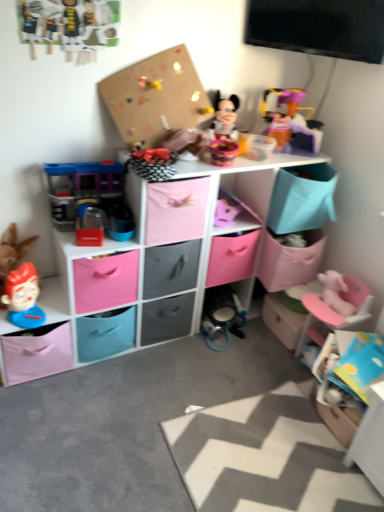
Question: From the image's perspective, is translucent plastic toy at upper right, which ranks as the third toy in left-to-right order, beneath wooden toy at lower right, the second storage box viewed from the left?

Choices:
 (A) yes
 (B) no

Answer: (B)

Question: Is translucent plastic toy at upper right, arranged as the third toy when ordered from the bottom, shorter than wooden toy at lower right, which is the 2th storage box in right-to-left order?

Choices:
 (A) yes
 (B) no

Answer: (B)

Question: Can you confirm if translucent plastic toy at upper right, arranged as the third toy when ordered from the bottom, is positioned to the right of wooden toy at lower right, which is the 2th storage box in right-to-left order?

Choices:
 (A) yes
 (B) no

Answer: (B)

Question: From a real-world perspective, does translucent plastic toy at upper right, the first toy in the top-to-bottom sequence, stand above wooden toy at lower right, the second storage box viewed from the left?

Choices:
 (A) yes
 (B) no

Answer: (A)

Question: Is there a large distance between translucent plastic toy at upper right, the first toy in the top-to-bottom sequence, and wooden toy at lower right, which is the 2th storage box in right-to-left order?

Choices:
 (A) yes
 (B) no

Answer: (B)

Question: Is translucent plastic toy at upper right, which ranks as the third toy in left-to-right order, to the left of wooden toy at lower right, which is the 2th storage box in right-to-left order, from the viewer's perspective?

Choices:
 (A) no
 (B) yes

Answer: (B)

Question: Considering the relative sizes of pink fabric storage cubes at center and smooth plastic toy head at lower left, the 3th toy from the top, in the image provided, is pink fabric storage cubes at center smaller than smooth plastic toy head at lower left, the 3th toy from the top,?

Choices:
 (A) no
 (B) yes

Answer: (A)

Question: Does pink fabric storage cubes at center have a lesser width compared to smooth plastic toy head at lower left, the 1th toy when ordered from bottom to top?

Choices:
 (A) no
 (B) yes

Answer: (A)

Question: Is pink fabric storage cubes at center far from smooth plastic toy head at lower left, the 1th toy when ordered from bottom to top?

Choices:
 (A) no
 (B) yes

Answer: (A)

Question: Does pink fabric storage cubes at center lie behind smooth plastic toy head at lower left, the 3th toy from the top?

Choices:
 (A) yes
 (B) no

Answer: (B)

Question: Is pink fabric storage cubes at center outside smooth plastic toy head at lower left, acting as the 3th toy starting from the right?

Choices:
 (A) yes
 (B) no

Answer: (A)

Question: Is pink fabric storage cubes at center wider than smooth plastic toy head at lower left, acting as the 3th toy starting from the right?

Choices:
 (A) yes
 (B) no

Answer: (A)

Question: Does translucent plastic toy at upper right, the first toy in the top-to-bottom sequence, have a lesser height compared to pink plastic swivel chair at lower right?

Choices:
 (A) yes
 (B) no

Answer: (A)